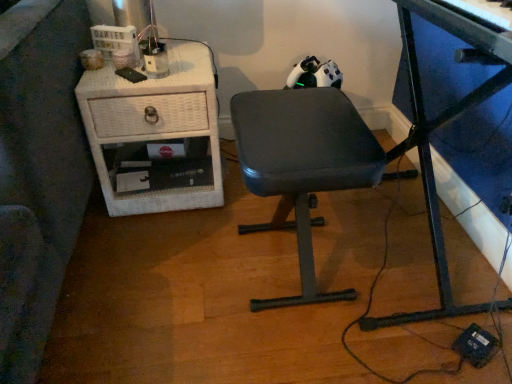
Locate an element on the screen. The width and height of the screenshot is (512, 384). free space between dark gray fabric chair at center and metallic blue desk at center is located at coordinates (316, 304).